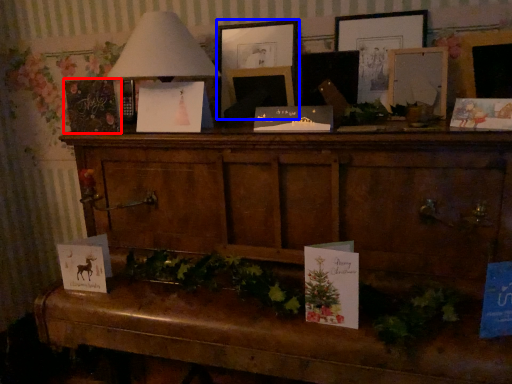
Question: Among these objects, which one is nearest to the camera, christmas card (highlighted by a red box) or picture frame (highlighted by a blue box)?

Choices:
 (A) christmas card
 (B) picture frame

Answer: (A)